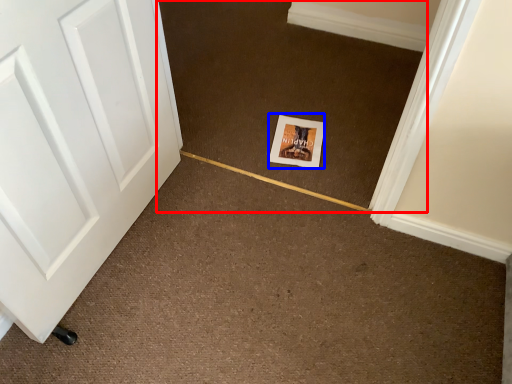
Question: Which object appears closest to the camera in this image, plain (highlighted by a red box) or postcard (highlighted by a blue box)?

Choices:
 (A) plain
 (B) postcard

Answer: (A)